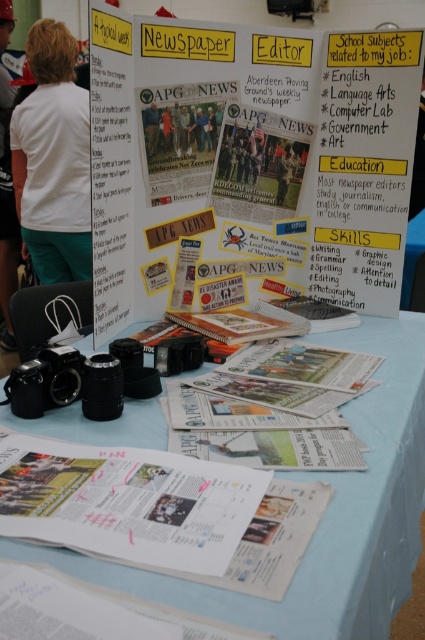
You are attending a career fair and looking at the display board for the newspaper editor role. You notice two white items on the board. The first is the white paper at center, and the second is the white fabric at upper left. Which of these two items is positioned closer to you?

The white paper at center is closer to the viewer than the white fabric at upper left.